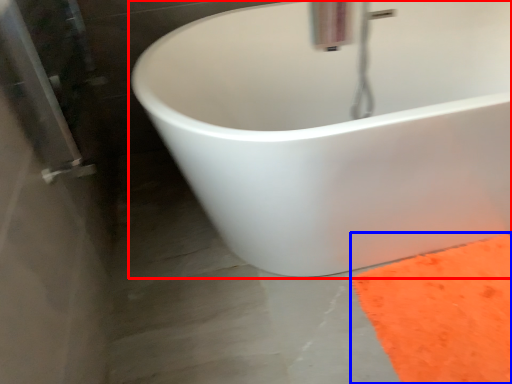
Question: Which point is closer to the camera, bathtub (highlighted by a red box) or doormat (highlighted by a blue box)?

Choices:
 (A) bathtub
 (B) doormat

Answer: (A)